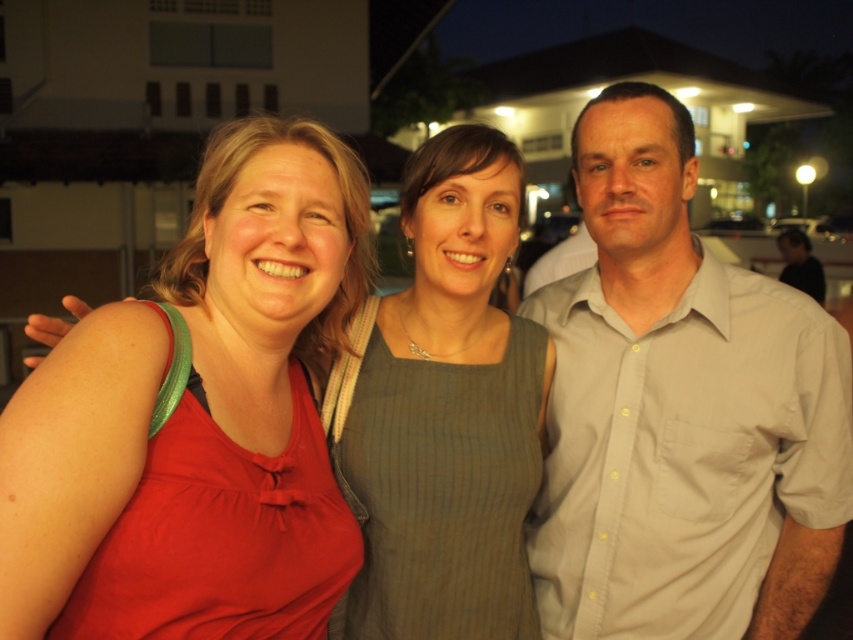
Who is taller, light gray button-up shirt at right or light gray shirt at center?

light gray shirt at center is taller.

Is point (793, 372) positioned before point (808, 260)?

Yes, point (793, 372) is closer to viewer.

Describe the element at coordinates (680, 412) in the screenshot. The image size is (853, 640). I see `light gray button-up shirt at right` at that location.

Find the location of a particular element. This screenshot has height=640, width=853. light gray button-up shirt at right is located at coordinates (680, 412).

Does matte red tank top at left appear on the right side of light gray shirt at center?

Incorrect, matte red tank top at left is not on the right side of light gray shirt at center.

Which is behind, point (231, 305) or point (815, 292)?

Point (815, 292)

Where is `matte red tank top at left`? Image resolution: width=853 pixels, height=640 pixels. matte red tank top at left is located at coordinates (244, 406).

The width and height of the screenshot is (853, 640). What do you see at coordinates (680, 412) in the screenshot?
I see `light gray button-up shirt at right` at bounding box center [680, 412].

Which is in front, point (651, 376) or point (306, 397)?

Point (306, 397)

Locate an element on the screen. light gray button-up shirt at right is located at coordinates (680, 412).